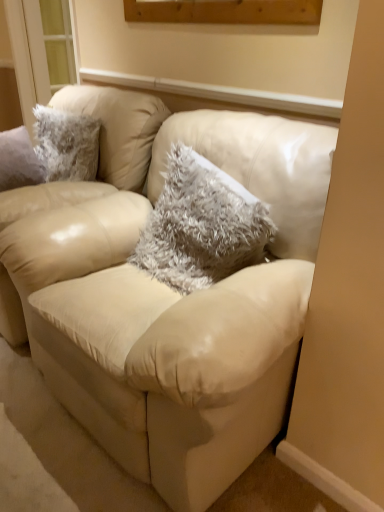
Question: In terms of size, does fuzzy gray pillow at center appear bigger or smaller than beige leather chair at center?

Choices:
 (A) big
 (B) small

Answer: (B)

Question: Considering the positions of point (205, 218) and point (21, 247), is point (205, 218) closer or farther from the camera than point (21, 247)?

Choices:
 (A) farther
 (B) closer

Answer: (B)

Question: Based on their relative distances, which object is nearer to the fuzzy gray pillow at center?

Choices:
 (A) beige leather couch at center
 (B) beige leather chair at center
 (C) transparent glass window at upper left

Answer: (A)

Question: Which object is positioned farthest from the transparent glass window at upper left?

Choices:
 (A) beige leather couch at center
 (B) beige leather chair at center
 (C) fuzzy gray pillow at center

Answer: (A)